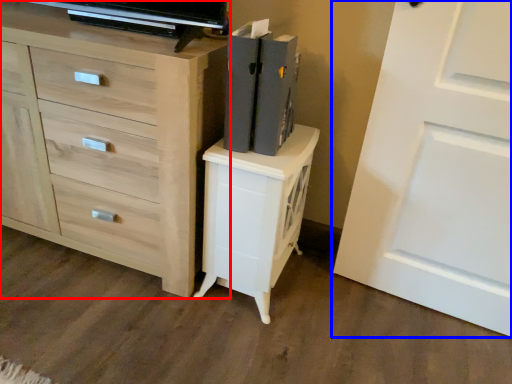
Question: Which object is closer to the camera taking this photo, chest of drawers (highlighted by a red box) or door (highlighted by a blue box)?

Choices:
 (A) chest of drawers
 (B) door

Answer: (B)